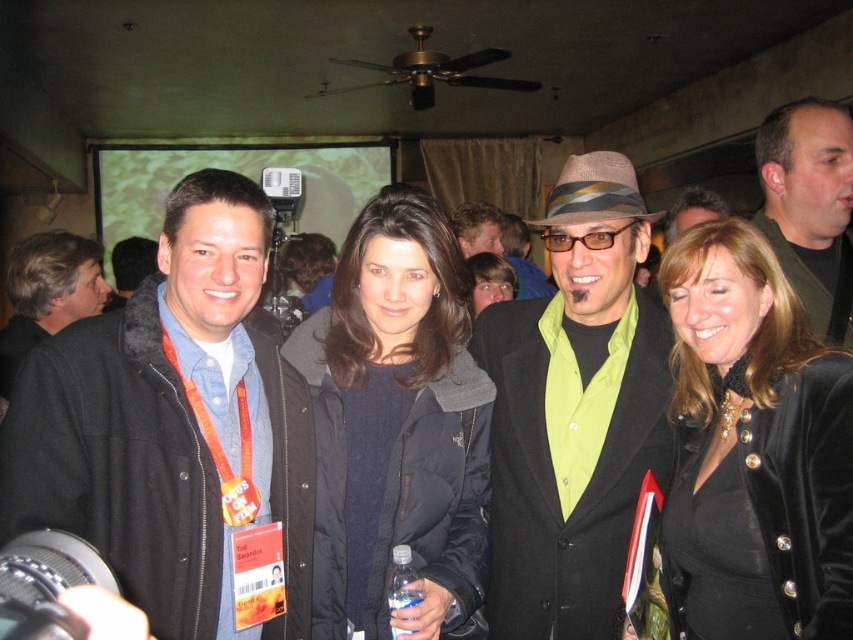
You are a photographer at the event and need to adjust the camera angle to ensure both the black matte jacket at left and the matte black jacket at center are fully visible in the frame. Given their heights, which jacket should you focus on to determine the optimal camera height?

The black matte jacket at left is taller than the matte black jacket at center. To ensure both are fully visible, the camera height should be adjusted to accommodate the taller jacket, so focus on the black matte jacket at left.

You are standing in the center of the image and want to hand a gift to the person wearing the black matte jacket at left. In which direction should you move to reach them?

The black matte jacket at left is located at point (172,422), so you should move to the left to reach them.

From the picture: You are at a social event and need to find the black matte jacket at left and matte black coat at center. Which one is positioned lower in the image?

The black matte jacket at left is located below matte black coat at center, so it is positioned lower in the image.